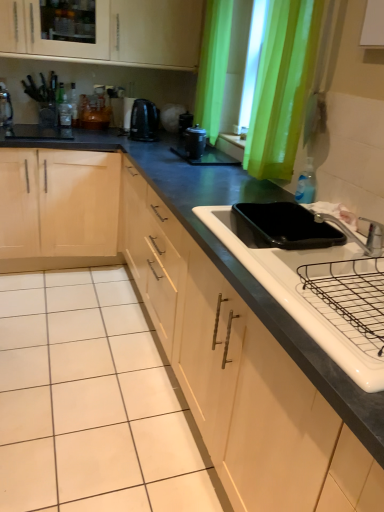
What do you see at coordinates (65, 112) in the screenshot? I see `clear glass bottle at upper left, positioned as the first bottle in back-to-front order` at bounding box center [65, 112].

In order to face blue translucent bottle at sink right, arranged as the 2th bottle when viewed from the left, should I rotate leftwards or rightwards?

Rotate your view right by about 15.378°.

Locate an element on the screen. The width and height of the screenshot is (384, 512). brushed metal kettle at left is located at coordinates (5, 106).

Is black matte pizza pan at sink completely or partially outside of white glossy sink at lower right?

No, most part of black matte pizza pan at sink lies within white glossy sink at lower right.

Visually, is black matte pizza pan at sink positioned to the left or to the right of white glossy sink at lower right?

black matte pizza pan at sink is positioned on white glossy sink at lower right's left side.

Between black matte pizza pan at sink and white glossy sink at lower right, which one has larger width?

white glossy sink at lower right is wider.

From the image's perspective, who appears lower, white glossy sink at lower right or matte wood cabinet at center?

matte wood cabinet at center.

Who is shorter, white glossy sink at lower right or matte wood cabinet at center?

Standing shorter between the two is white glossy sink at lower right.

Is matte wood cabinet at center at the back of white glossy sink at lower right?

Yes.

The height and width of the screenshot is (512, 384). In order to click on sink in front of the matte wood cabinet at center in this screenshot , I will do `click(316, 292)`.

What's the angular difference between matte black coffee maker at center and black matte pizza pan at sink's facing directions?

0.47 degrees.

Is matte black coffee maker at center touching black matte pizza pan at sink?

No, matte black coffee maker at center is not in contact with black matte pizza pan at sink.

Is black matte pizza pan at sink at the back of matte black coffee maker at center?

That's not correct — matte black coffee maker at center is not looking away from black matte pizza pan at sink.

Based on the photo, how distant is matte black coffee maker at center from black matte pizza pan at sink?

34.98 inches.

Which bottle is the 2nd one when counting from the back of the white glossy sink at lower right? Please provide its 2D coordinates.

[(65, 112)]

Considering the relative sizes of clear glass bottle at upper left, positioned as the 2th bottle in bottom-to-top order, and white glossy sink at lower right in the image provided, is clear glass bottle at upper left, positioned as the 2th bottle in bottom-to-top order, thinner than white glossy sink at lower right?

Correct, the width of clear glass bottle at upper left, positioned as the 2th bottle in bottom-to-top order, is less than that of white glossy sink at lower right.

Is clear glass bottle at upper left, which is the second bottle from front to back, further to the viewer compared to white glossy sink at lower right?

Yes.

In the scene shown: Is clear glass bottle at upper left, which is the second bottle from front to back, positioned in front of matte black coffee maker at center?

That is False.

Is clear glass bottle at upper left, positioned as the first bottle in back-to-front order, wider than matte black coffee maker at center?

Incorrect, the width of clear glass bottle at upper left, positioned as the first bottle in back-to-front order, does not surpass that of matte black coffee maker at center.

Consider the image. Is clear glass bottle at upper left, which is counted as the second bottle, starting from the right, oriented away from matte black coffee maker at center?

No, clear glass bottle at upper left, which is counted as the second bottle, starting from the right, is not facing away from matte black coffee maker at center.

Is clear glass bottle at upper left, which is counted as the second bottle, starting from the right, not close to matte black coffee maker at center?

Yes.

From a real-world perspective, which is physically below, matte wood cabinet at center or black matte pizza pan at sink?

matte wood cabinet at center is physically lower.

How far apart are matte wood cabinet at center and black matte pizza pan at sink?

A distance of 17.84 inches exists between matte wood cabinet at center and black matte pizza pan at sink.

Which object is positioned more to the right, matte wood cabinet at center or black matte pizza pan at sink?

black matte pizza pan at sink.

Considering the sizes of objects matte wood cabinet at center and black matte pizza pan at sink in the image provided, who is wider, matte wood cabinet at center or black matte pizza pan at sink?

Wider between the two is matte wood cabinet at center.

Based on the photo, is clear glass bottle at upper left, the first bottle from the left, oriented away from matte wood cabinet at center?

clear glass bottle at upper left, the first bottle from the left, does not have its back to matte wood cabinet at center.

Can you tell me how much clear glass bottle at upper left, positioned as the first bottle in back-to-front order, and matte wood cabinet at center differ in facing direction?

There is a 89.1-degree angle between the facing directions of clear glass bottle at upper left, positioned as the first bottle in back-to-front order, and matte wood cabinet at center.

Does clear glass bottle at upper left, which is the second bottle from front to back, come in front of matte wood cabinet at center?

No, clear glass bottle at upper left, which is the second bottle from front to back, is behind matte wood cabinet at center.

Is clear glass bottle at upper left, which is the second bottle from front to back, far away from matte wood cabinet at center?

That's right, there is a large distance between clear glass bottle at upper left, which is the second bottle from front to back, and matte wood cabinet at center.

At what (x,y) coordinates should I click in order to perform the action: click on sink located on the right of black matte pizza pan at sink. Please return your answer as a coordinate pair (x, y). The image size is (384, 512). Looking at the image, I should click on (316, 292).

Where is `cabinetry behind the white glossy sink at lower right`? This screenshot has height=512, width=384. cabinetry behind the white glossy sink at lower right is located at coordinates click(240, 375).

Looking at this image, estimate the real-world distances between objects in this image. Which object is further from blue translucent bottle at sink right, the 1th bottle in the front-to-back sequence, black glossy electric kettle at center or matte wood cabinet at center?

black glossy electric kettle at center.

Consider the image. From the image, which object appears to be farther from black matte pizza pan at sink, matte wood cabinet at center or white glossy sink at lower right?

matte wood cabinet at center is further to black matte pizza pan at sink.

Looking at the image, which one is located further to silver metallic faucet at upper right, black glossy electric kettle at center or matte wood cabinet at center?

black glossy electric kettle at center is further to silver metallic faucet at upper right.

Considering their positions, is silver metallic faucet at upper right positioned further to black glossy electric kettle at center than white glossy sink at lower right?

The object further to black glossy electric kettle at center is white glossy sink at lower right.

Estimate the real-world distances between objects in this image. Which object is closer to blue translucent bottle at sink right, the 1th bottle viewed from the right, matte black coffee maker at center or brushed metal kettle at left?

Based on the image, matte black coffee maker at center appears to be nearer to blue translucent bottle at sink right, the 1th bottle viewed from the right.

Which object lies nearer to the anchor point matte wood cabinet at center, white glossy sink at lower right or silver metallic faucet at upper right?

white glossy sink at lower right.

Based on their spatial positions, is green fabric curtain at upper right or silver metallic faucet at upper right further from blue translucent bottle at sink right, marked as the 2th bottle in a back-to-front arrangement?

Based on the image, green fabric curtain at upper right appears to be further to blue translucent bottle at sink right, marked as the 2th bottle in a back-to-front arrangement.

Estimate the real-world distances between objects in this image. Which object is further from black matte pizza pan at sink, green fabric curtain at upper right or white glossy sink at lower right?

green fabric curtain at upper right is further to black matte pizza pan at sink.

At what (x,y) coordinates should I click in order to perform the action: click on pizza pan between matte wood cabinet at center and black glossy electric kettle at center from front to back. Please return your answer as a coordinate pair (x, y). This screenshot has height=512, width=384. Looking at the image, I should click on (288, 226).

This screenshot has width=384, height=512. I want to click on curtain positioned between matte wood cabinet at center and brushed metal kettle at left from near to far, so click(282, 87).

I want to click on cabinetry between brushed metal kettle at left and blue translucent bottle at sink right, arranged as the 2th bottle when viewed from the left, so click(240, 375).

Locate an element on the screen. The image size is (384, 512). kitchen appliance between green fabric curtain at upper right and black glossy electric kettle at center in the front-back direction is located at coordinates (195, 142).